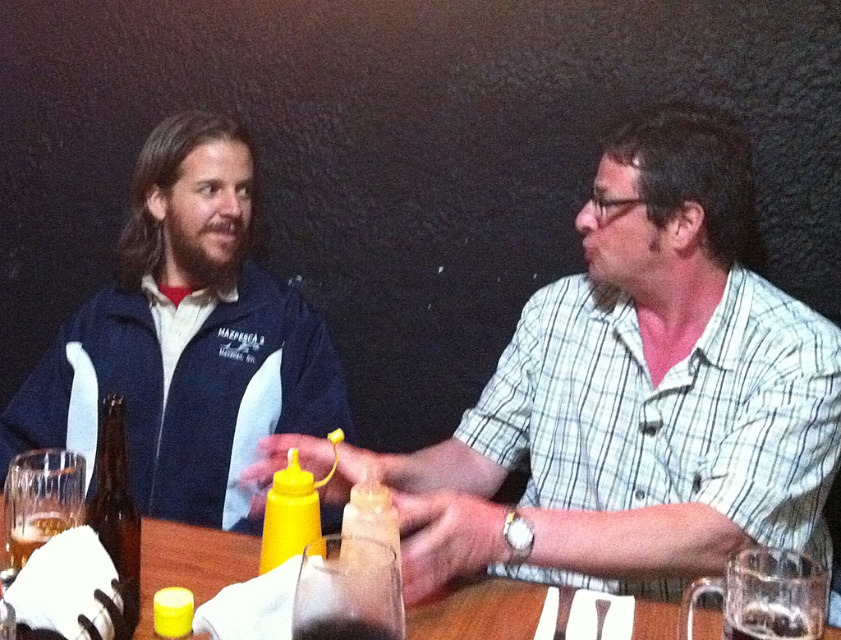
You are sitting at the table between the two people. To reach the item at point (339, 493) and the item at point (184, 228), which one is closer to you?

The point (339, 493) is in front of point (184, 228), so it is closer to you.

You are a chef preparing to place a new bottle of hot sauce on the table between the matte yellow mustard bottle at center and the blue fleece jacket at left. The hot sauce bottle is 10 cm wide. Can you fit it between them without moving any existing items?

The matte yellow mustard bottle at center has a larger width than the blue fleece jacket at left. Since the hot sauce bottle is 10 cm wide, it depends on the space between them. However, since the mustard bottle is wider, there might not be enough space. Please check the actual distance between them first.

You are planning to place a new item on the table between the wooden table at center and the translucent plastic mustard at center. Considering their sizes, which object should you place the item closer to?

Since the wooden table at center is larger than the translucent plastic mustard at center, you should place the item closer to the translucent plastic mustard at center to maintain balance.